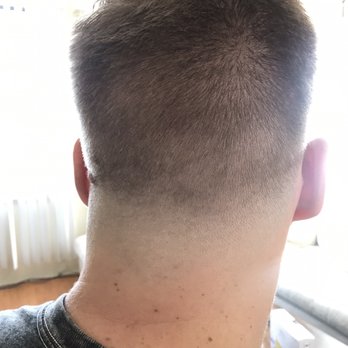
The image size is (348, 348). What are the coordinates of `white curtains` in the screenshot? It's located at (26, 242).